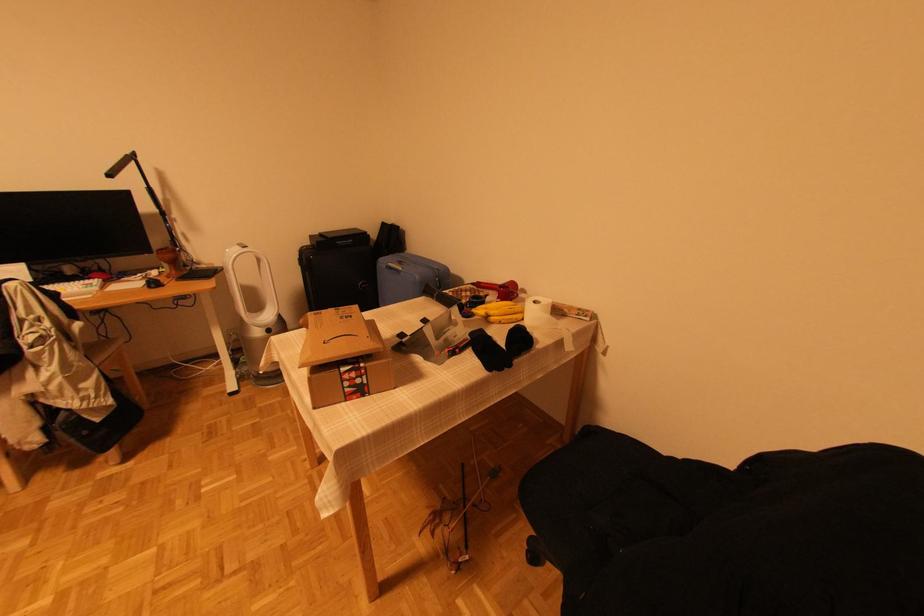
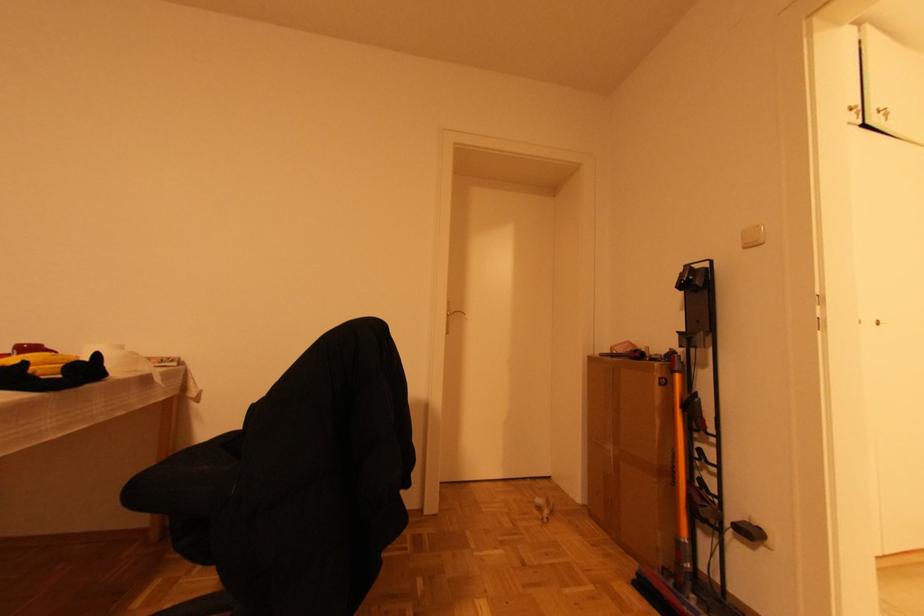
Question: The camera is either moving clockwise (left) or counter-clockwise (right) around the object. The first image is from the beginning of the video and the second image is from the end. Is the camera moving left or right when shooting the video?

Choices:
 (A) Left
 (B) Right

Answer: (A)